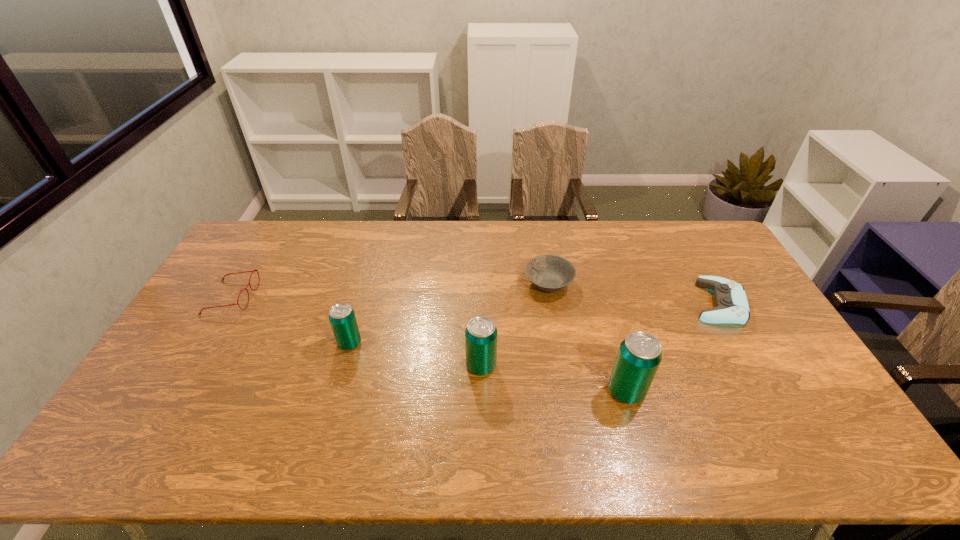
In the current image, all beer cans are evenly spaced. To maintain this equal spacing, where should an additional beer can be placed on the right? Please point out a free spot. Please provide its 2D coordinates. Your answer should be formatted as a tuple, i.e. [(x, y)], where the tuple contains the x and y coordinates of a point satisfying the conditions above.

[(787, 419)]